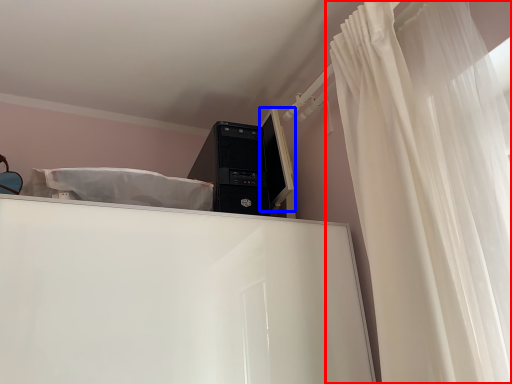
Question: Among these objects, which one is nearest to the camera, curtain (highlighted by a red box) or computer monitor (highlighted by a blue box)?

Choices:
 (A) curtain
 (B) computer monitor

Answer: (A)